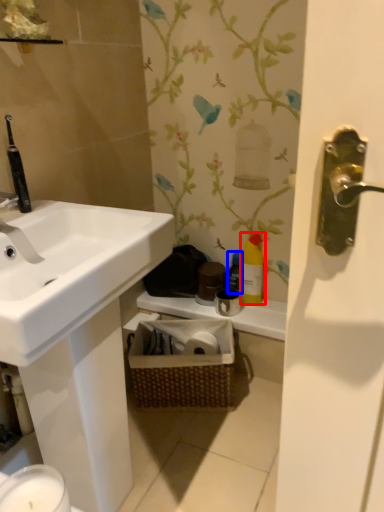
Question: Which object is closer to the camera taking this photo, cleaning product (highlighted by a red box) or bottle (highlighted by a blue box)?

Choices:
 (A) cleaning product
 (B) bottle

Answer: (A)